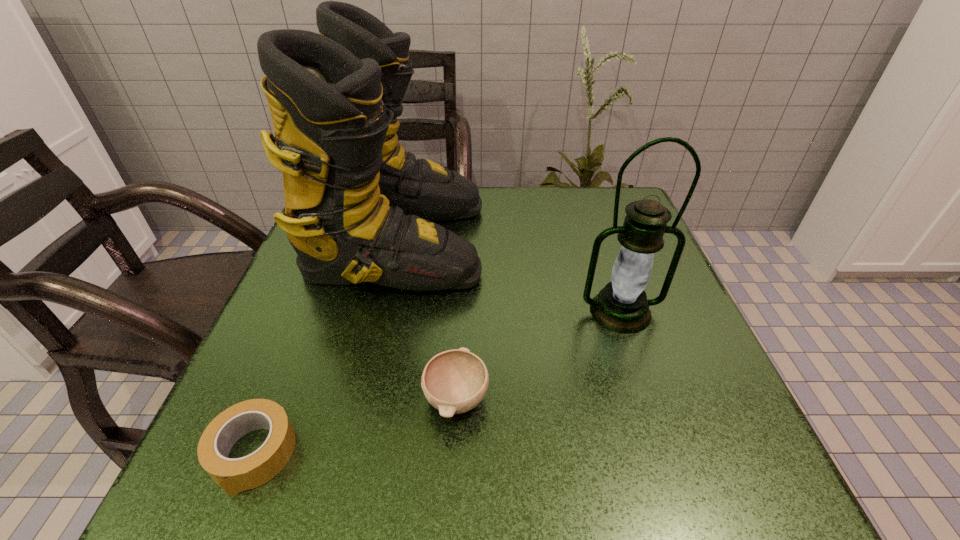
You are a GUI agent. You are given a task and a screenshot of the screen. Output one action in this format:
    pyautogui.click(x=<x>, y=<y>)
    Task: Click on the tallest object
    The width and height of the screenshot is (960, 540).
    Given the screenshot: What is the action you would take?
    pyautogui.click(x=358, y=208)

Find the location of a particular element. This screenshot has width=960, height=540. the second tallest object is located at coordinates (622, 306).

This screenshot has width=960, height=540. Find the location of `lantern`. lantern is located at coordinates pyautogui.click(x=622, y=306).

I want to click on bowl, so click(455, 381).

I want to click on the shortest object, so click(236, 475).

You are a GUI agent. You are given a task and a screenshot of the screen. Output one action in this format:
    pyautogui.click(x=<x>, y=<y>)
    Task: Click on the blank space located 0.360m on the front of the ski boots
    This screenshot has height=540, width=960.
    Given the screenshot: What is the action you would take?
    pyautogui.click(x=342, y=489)

The height and width of the screenshot is (540, 960). I want to click on vacant space located on the side where the rightmost object emits light, so click(636, 360).

At what (x,y) coordinates should I click in order to perform the action: click on vacant space located 0.220m on the back of the second shortest object. Please return your answer as a coordinate pair (x, y). This screenshot has width=960, height=540. Looking at the image, I should click on click(462, 282).

Image resolution: width=960 pixels, height=540 pixels. Identify the location of object located in the far edge section of the desktop. (358, 208).

The width and height of the screenshot is (960, 540). I want to click on object located at the near edge, so click(x=236, y=475).